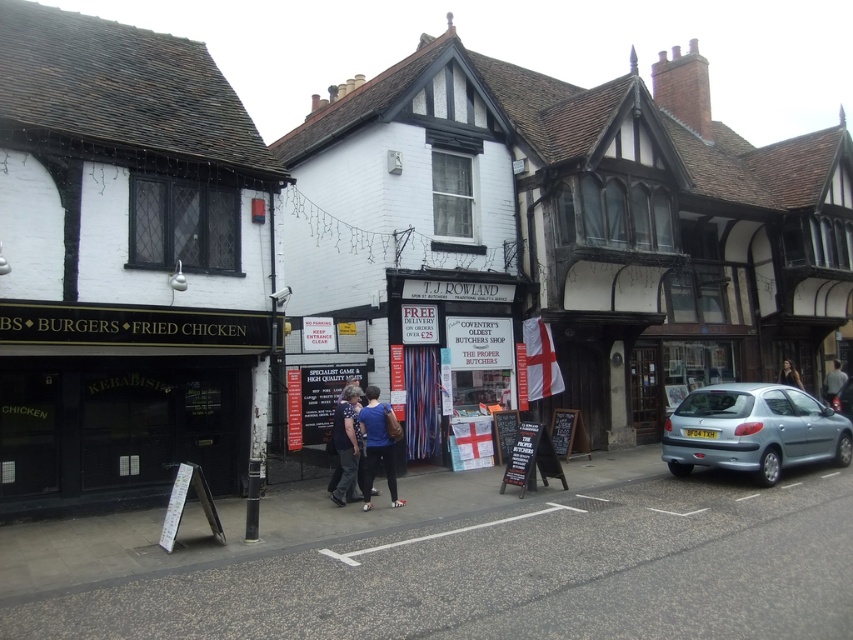
Question: Which point appears closest to the camera in this image?

Choices:
 (A) (833, 369)
 (B) (351, 472)

Answer: (B)

Question: Does blue fabric backpack at center have a greater width compared to dark hair at center?

Choices:
 (A) yes
 (B) no

Answer: (B)

Question: Which object is closer to the camera taking this photo?

Choices:
 (A) blue fabric backpack at center
 (B) silver metallic car at right

Answer: (A)

Question: Which object is farther from the camera taking this photo?

Choices:
 (A) blue fabric backpack at center
 (B) silver metallic car at right

Answer: (B)

Question: Does metallic silver car at right have a greater width compared to blue denim jeans at center?

Choices:
 (A) yes
 (B) no

Answer: (A)

Question: Does gray fabric shirt at center-right appear on the right side of silver metallic car at right?

Choices:
 (A) no
 (B) yes

Answer: (B)